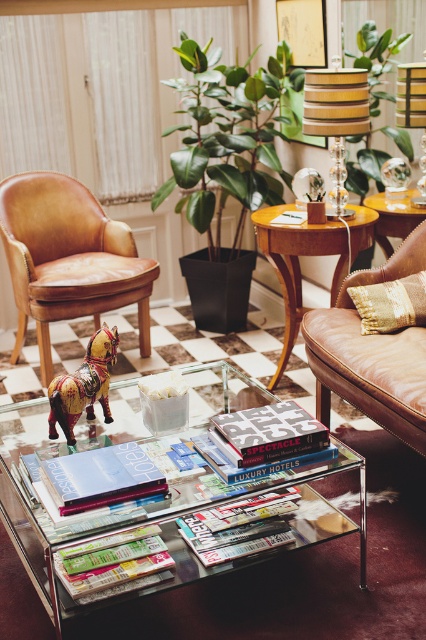
Is the position of matte silver magazine at center less distant than that of matte hardcover book at center?

Yes, matte silver magazine at center is in front of matte hardcover book at center.

Between point (51, 467) and point (305, 448), which one is positioned behind?

The point (305, 448) is behind.

Find the location of `matte silver magazine at center`. matte silver magazine at center is located at coordinates (100, 476).

From the picture: Can you confirm if matte brown leather armchair at left is positioned above painted wood horse at center?

Indeed, matte brown leather armchair at left is positioned over painted wood horse at center.

Between point (115, 305) and point (77, 388), which one is positioned in front?

Point (77, 388) is in front.

You are a GUI agent. You are given a task and a screenshot of the screen. Output one action in this format:
    pyautogui.click(x=<x>, y=<y>)
    Task: Click on the matte brown leather armchair at left
    
    Given the screenshot: What is the action you would take?
    pyautogui.click(x=68, y=259)

Is leather couch at right to the left of matte wood side table at upper right from the viewer's perspective?

Yes, leather couch at right is to the left of matte wood side table at upper right.

Between point (359, 372) and point (391, 205), which one is positioned behind?

The point (391, 205) is behind.

The width and height of the screenshot is (426, 640). I want to click on leather couch at right, so click(371, 353).